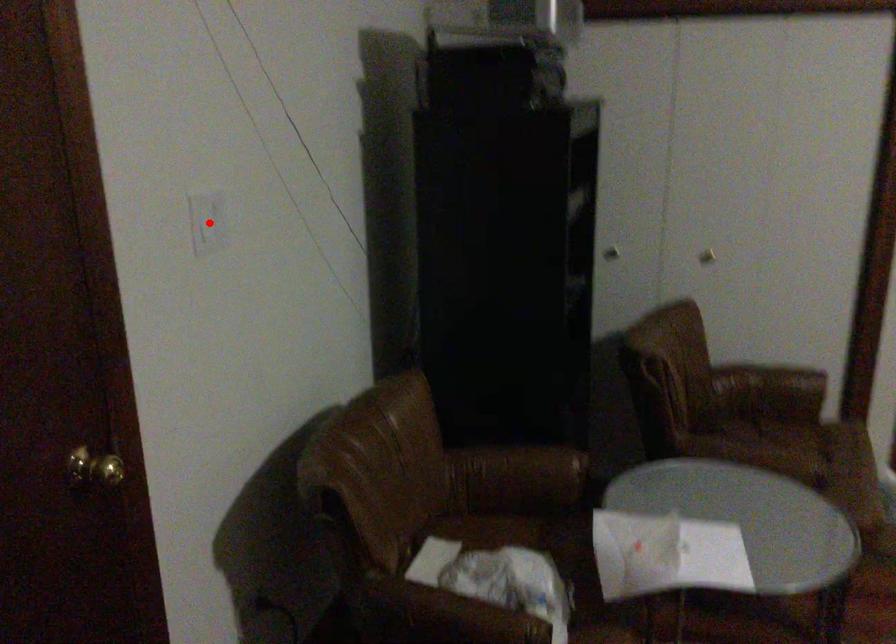
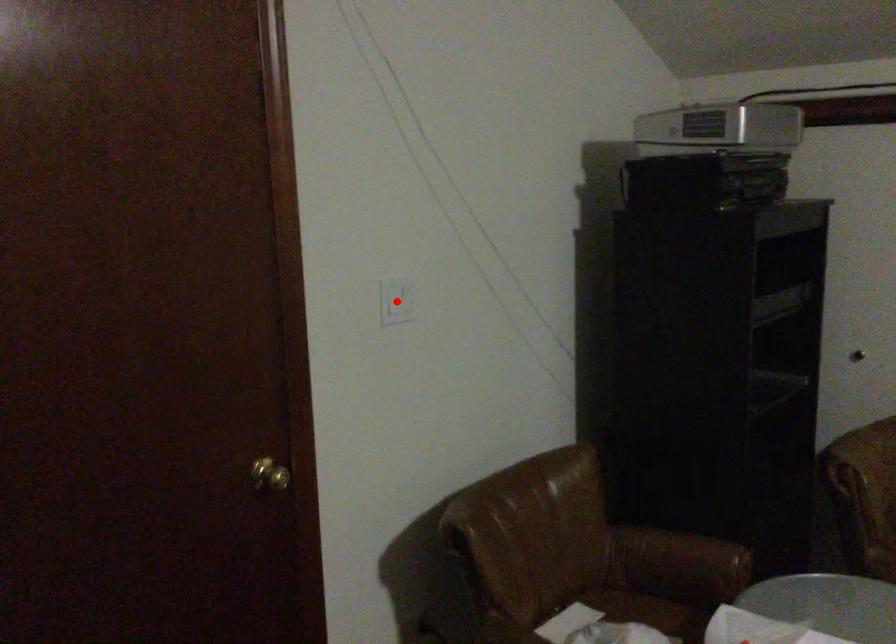
I am providing you with two images of the same scene from different viewpoints. A red point is marked on the first image and another point is marked on the second image. Does the point marked in image1 correspond to the same location as the one in image2?

Yes